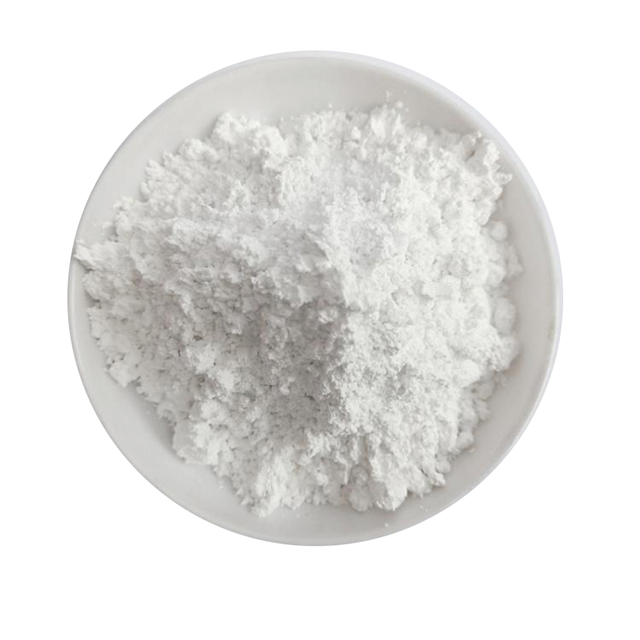
Locate an element on the screen. The image size is (640, 640). inside left side of bowl is located at coordinates (91, 371), (127, 404).